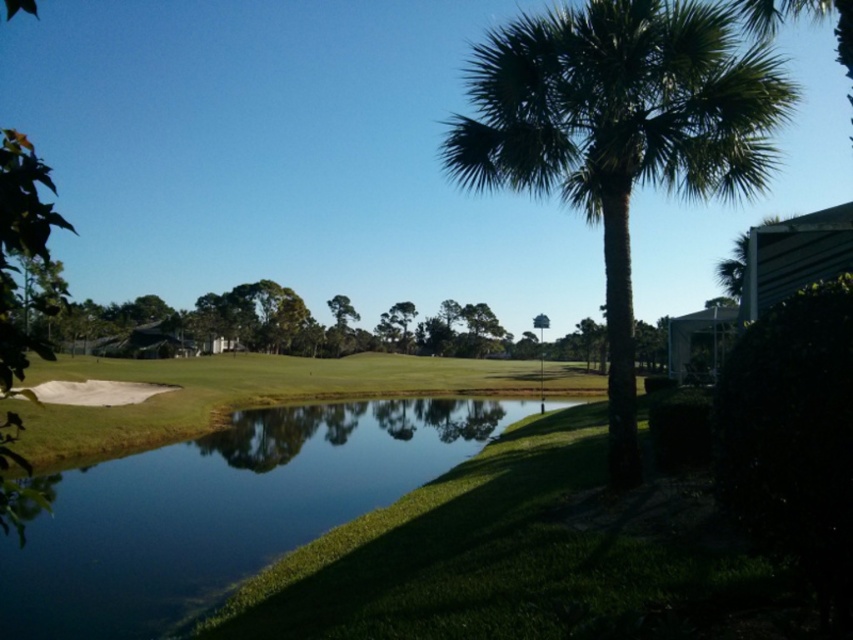
The image size is (853, 640). Describe the element at coordinates (222, 509) in the screenshot. I see `clear water at pond center` at that location.

Is clear water at pond center to the left of green leafy palm tree at right from the viewer's perspective?

Correct, you'll find clear water at pond center to the left of green leafy palm tree at right.

Does point (402, 412) come behind point (701, 86)?

Yes.

Find the location of a particular element. clear water at pond center is located at coordinates 222,509.